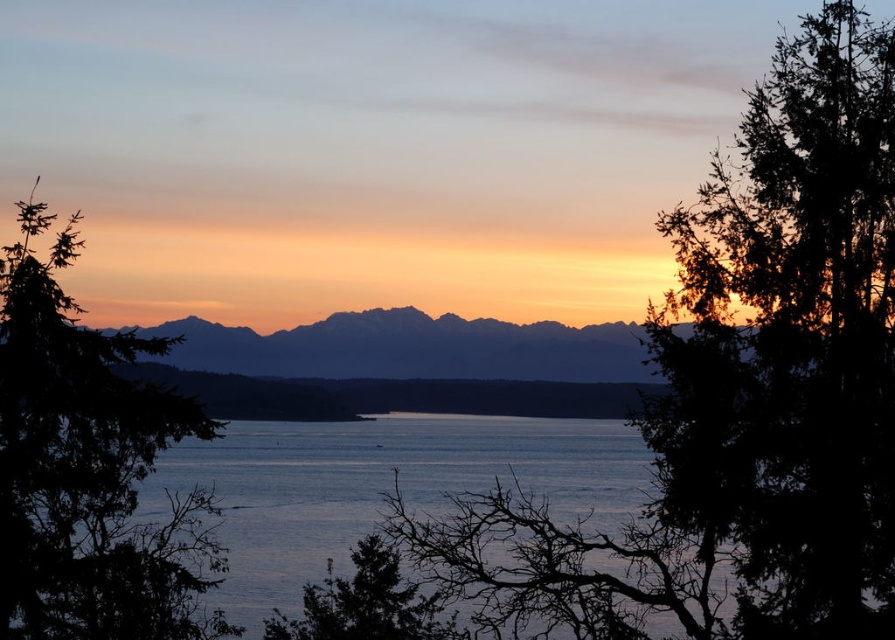
Question: Considering the relative positions of blue water at center and green matte tree at lower center in the image provided, where is blue water at center located with respect to green matte tree at lower center?

Choices:
 (A) right
 (B) left

Answer: (B)

Question: Which object appears closest to the camera in this image?

Choices:
 (A) green leafy tree at right
 (B) green matte tree at lower center
 (C) blue water at center

Answer: (A)

Question: Which object is positioned farthest from the green matte tree at lower center?

Choices:
 (A) green leafy tree at left
 (B) blue water at center

Answer: (B)

Question: Is green leafy tree at right positioned before blue water at center?

Choices:
 (A) no
 (B) yes

Answer: (B)

Question: Is green leafy tree at left smaller than silhouetted rock formation at center?

Choices:
 (A) no
 (B) yes

Answer: (A)

Question: Among these points, which one is nearest to the camera?

Choices:
 (A) (195, 346)
 (B) (62, 372)
 (C) (437, 611)

Answer: (B)